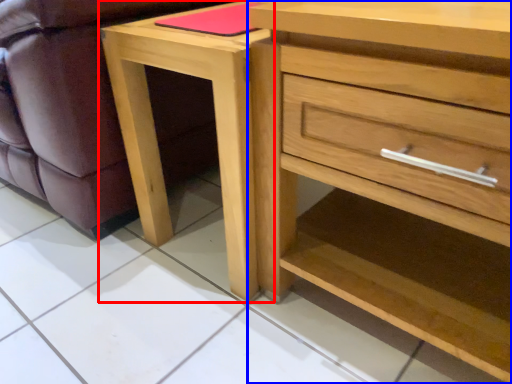
Question: Which object appears farthest to the camera in this image, nightstand (highlighted by a red box) or chest of drawers (highlighted by a blue box)?

Choices:
 (A) nightstand
 (B) chest of drawers

Answer: (A)